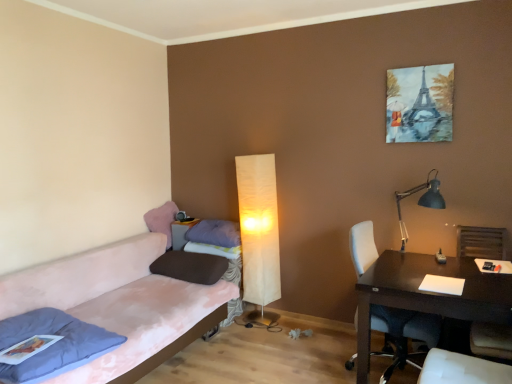
Question: Should I look upward or downward to see blue fabric pillow at lower left, which is the fourth pillow in back-to-front order?

Choices:
 (A) down
 (B) up

Answer: (A)

Question: Considering the relative positions of blue matte desk lamp at right, positioned as the second lamp in left-to-right order, and blue fabric pillow at lower left, the first pillow in the front-to-back sequence, in the image provided, is blue matte desk lamp at right, positioned as the second lamp in left-to-right order, to the left of blue fabric pillow at lower left, the first pillow in the front-to-back sequence, from the viewer's perspective?

Choices:
 (A) no
 (B) yes

Answer: (A)

Question: Does blue matte desk lamp at right, the first lamp in the right-to-left sequence, come behind blue fabric pillow at lower left, which is the fourth pillow in back-to-front order?

Choices:
 (A) yes
 (B) no

Answer: (A)

Question: Is blue matte desk lamp at right, which is the 2th lamp from back to front, aimed at blue fabric pillow at lower left, which is the fourth pillow in back-to-front order?

Choices:
 (A) yes
 (B) no

Answer: (B)

Question: Can you confirm if blue matte desk lamp at right, positioned as the second lamp in left-to-right order, is positioned to the right of blue fabric pillow at lower left, which is the fourth pillow in back-to-front order?

Choices:
 (A) yes
 (B) no

Answer: (A)

Question: From a real-world perspective, does blue matte desk lamp at right, the first lamp in the right-to-left sequence, stand above blue fabric pillow at lower left, which is the fourth pillow in back-to-front order?

Choices:
 (A) yes
 (B) no

Answer: (A)

Question: Does blue matte desk lamp at right, which is the 2th lamp from back to front, have a larger size compared to blue fabric pillow at lower left, the first pillow in the front-to-back sequence?

Choices:
 (A) no
 (B) yes

Answer: (B)

Question: From a real-world perspective, does white leather chair at right sit lower than blue fabric pillow at lower left, the first pillow in the front-to-back sequence?

Choices:
 (A) yes
 (B) no

Answer: (B)

Question: Can you confirm if white leather chair at right is shorter than blue fabric pillow at lower left, the first pillow in the front-to-back sequence?

Choices:
 (A) yes
 (B) no

Answer: (B)

Question: Does white leather chair at right have a greater height compared to blue fabric pillow at lower left, the first pillow in the front-to-back sequence?

Choices:
 (A) no
 (B) yes

Answer: (B)

Question: From a real-world perspective, is white leather chair at right over blue fabric pillow at lower left, the first pillow in the front-to-back sequence?

Choices:
 (A) yes
 (B) no

Answer: (A)

Question: Is white leather chair at right to the left of blue fabric pillow at lower left, the first pillow in the front-to-back sequence, from the viewer's perspective?

Choices:
 (A) yes
 (B) no

Answer: (B)

Question: Could you tell me if white leather chair at right is facing blue fabric pillow at lower left, which is the fourth pillow in back-to-front order?

Choices:
 (A) no
 (B) yes

Answer: (A)

Question: From a real-world perspective, is pink fabric couch at left below brown matte pillow at center, which is the 3th pillow in back-to-front order?

Choices:
 (A) yes
 (B) no

Answer: (A)